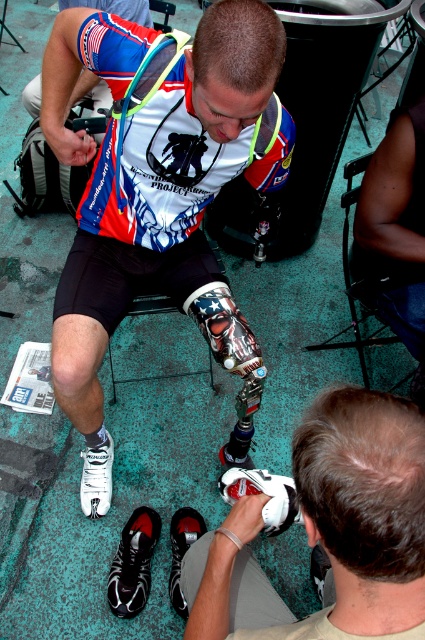
You are a physical therapist helping a patient choose between the white matte shoe at lower left and the black leather shoe at lower center. Which shoe is more suitable for a patient needing a wider fit for their prosthetic leg?

The black leather shoe at lower center is wider than the white matte shoe at lower left, so it is more suitable for a patient needing a wider fit for their prosthetic leg.

You are a physical therapist observing the person fitting their prosthetic leg. You need to retrieve the white matte shoe at lower left and the black leather shoe at lower center. Which shoe should you pick up first to avoid obstructing the prosthetic leg being fitted?

The white matte shoe at lower left is closer to the viewer and thus should be picked up first to avoid obstructing the prosthetic leg being fitted, as it is in front of the black leather shoe at lower center.

You are a shoe designer observing the prosthetic setup. You need to choose between the black mesh shoe at lower left and the white matte shoe at lower left for a client who prefers wider footwear. Which shoe should you recommend?

The black mesh shoe at lower left is wider than the white matte shoe at lower left, so you should recommend the black mesh shoe at lower left for the client who prefers wider footwear.